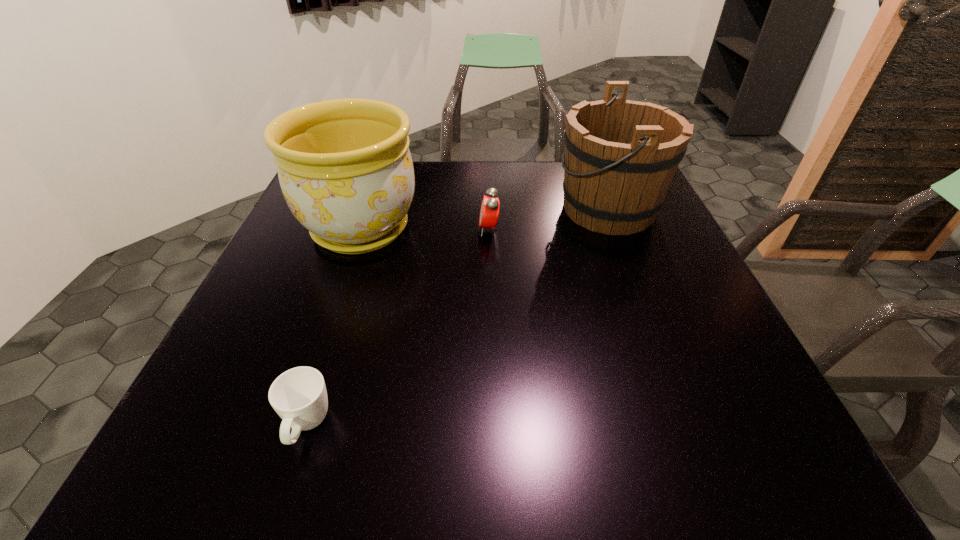
You are a GUI agent. You are given a task and a screenshot of the screen. Output one action in this format:
    pyautogui.click(x=<x>, y=<y>)
    Task: Click on the vacant area that lies between the third object from left to right and the shortest object
    The width and height of the screenshot is (960, 540).
    Given the screenshot: What is the action you would take?
    [397, 328]

Locate an element on the screen. unoccupied area between the alarm clock and the cup is located at coordinates (397, 328).

Identify the location of free space between the rightmost object and the third object from left to right. Image resolution: width=960 pixels, height=540 pixels. (549, 219).

Locate an element on the screen. free area in between the nearest object and the rightmost object is located at coordinates (458, 318).

Find the location of a particular element. free space between the flowerpot and the second shortest object is located at coordinates (424, 230).

Find the location of a particular element. This screenshot has height=540, width=960. object that is the third closest to the wine bucket is located at coordinates (299, 396).

Locate an element on the screen. The width and height of the screenshot is (960, 540). the second closest object relative to the cup is located at coordinates (489, 211).

Find the location of a particular element. vacant point that satisfies the following two spatial constraints: 1. on the side of the rightmost object with the handle for carrying; 2. on the front side of the flowerpot is located at coordinates (616, 229).

Identify the location of vacant region that satisfies the following two spatial constraints: 1. on the side of the wine bucket with the handle for carrying; 2. with the handle on the side of the nearest object. The height and width of the screenshot is (540, 960). (693, 426).